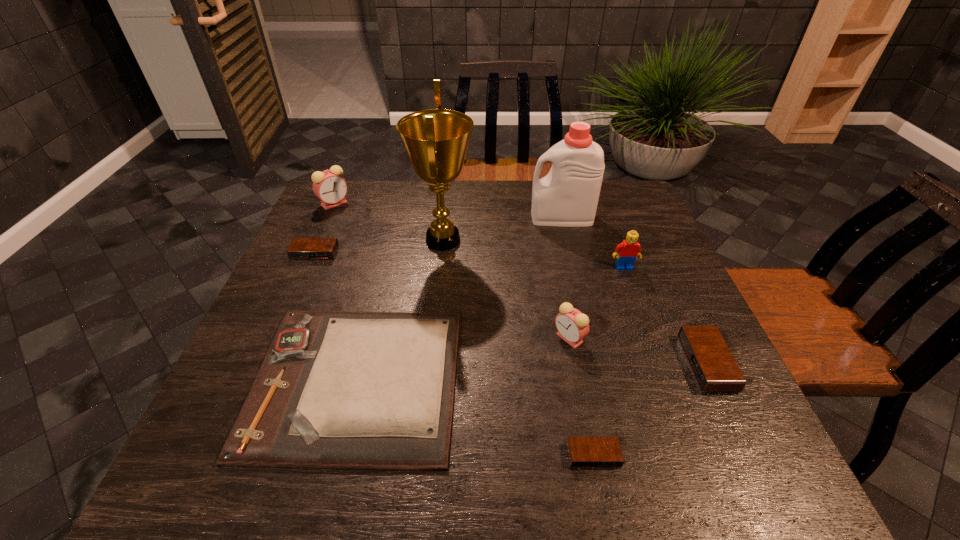
Find the location of a particular element. This screenshot has width=960, height=540. free space between the clipboard and the white detergent is located at coordinates (459, 299).

The height and width of the screenshot is (540, 960). Find the location of `vacant space that's between the left pink alarm clock and the gold award`. vacant space that's between the left pink alarm clock and the gold award is located at coordinates (389, 222).

At what (x,y) coordinates should I click in order to perform the action: click on unoccupied position between the farther pink alarm clock and the award. Please return your answer as a coordinate pair (x, y). Looking at the image, I should click on (389, 222).

Locate an element on the screen. This screenshot has width=960, height=540. free point between the second farthest alarm clock and the farther pink alarm clock is located at coordinates (324, 228).

In order to click on the seventh closest object to the biggest black alarm clock in this screenshot , I will do `click(301, 248)`.

Where is `object that is the eighth closest one to the red Lego`? This screenshot has height=540, width=960. object that is the eighth closest one to the red Lego is located at coordinates (329, 186).

Find the location of `the second closest alarm clock to the clipboard`. the second closest alarm clock to the clipboard is located at coordinates (584, 452).

Identify which alarm clock is the second nearest to the brown clipboard. Please provide its 2D coordinates. Your answer should be formatted as a tuple, i.e. [(x, y)], where the tuple contains the x and y coordinates of a point satisfying the conditions above.

[(584, 452)]

Locate an element on the screen. the second closest black alarm clock to the gold award is located at coordinates (714, 367).

Where is `black alarm clock that stands as the third closest to the fourth shortest alarm clock`? This screenshot has height=540, width=960. black alarm clock that stands as the third closest to the fourth shortest alarm clock is located at coordinates (301, 248).